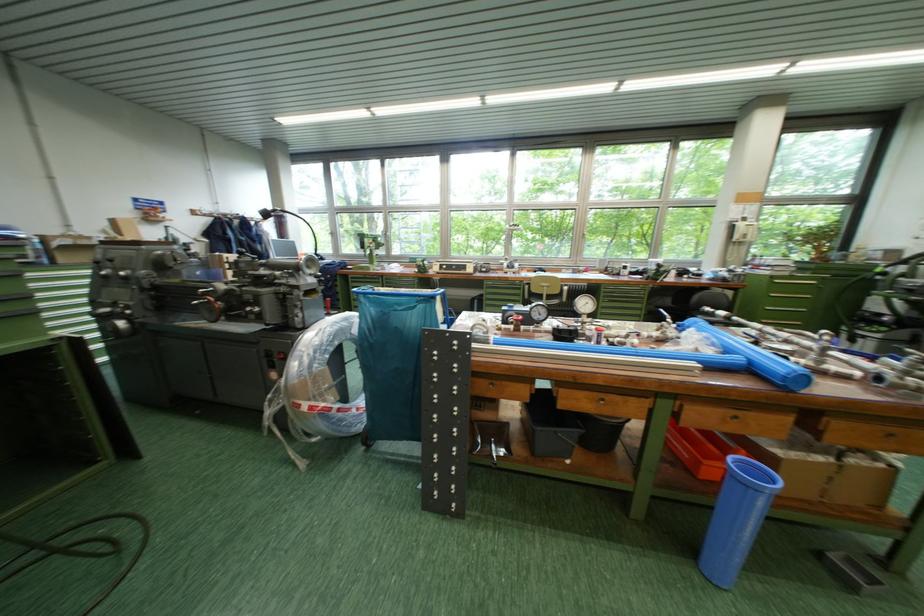
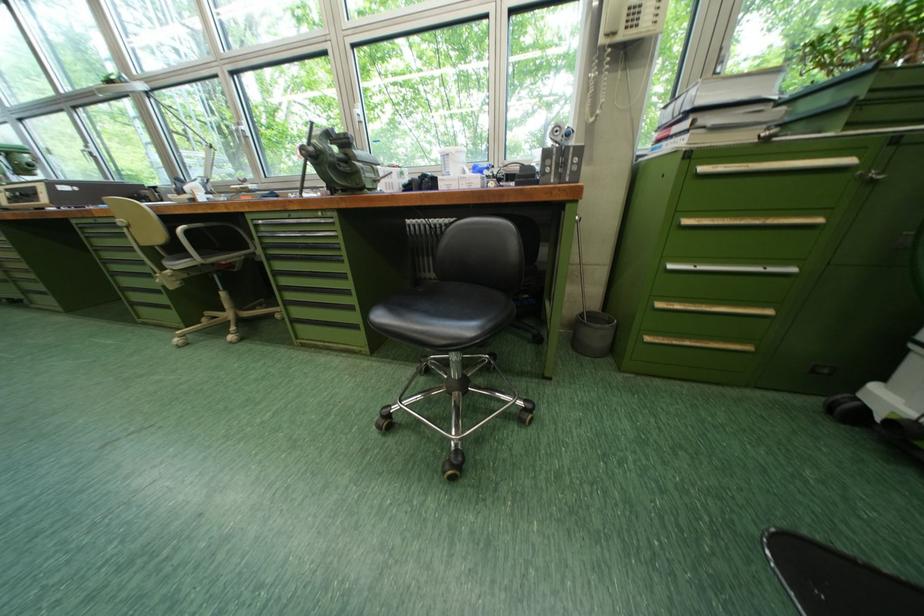
Which direction would the cameraman need to move to produce the second image?

The cameraman moved toward right, forward.